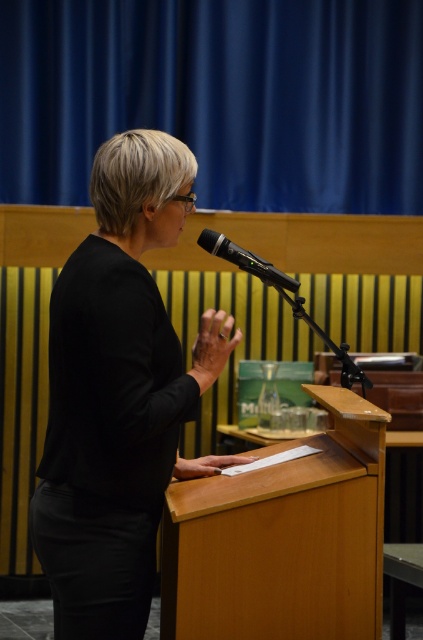
Question: Is black matte shirt at center closer to camera compared to light brown wood podium at center?

Choices:
 (A) yes
 (B) no

Answer: (A)

Question: Can you confirm if blue fabric curtain at upper center is wider than light brown wood podium at center?

Choices:
 (A) no
 (B) yes

Answer: (B)

Question: Can you confirm if light brown wood podium at center is positioned to the right of black metallic microphone at center?

Choices:
 (A) no
 (B) yes

Answer: (B)

Question: Which object is the closest to the light brown wood podium at center?

Choices:
 (A) blue fabric curtain at upper center
 (B) black matte shirt at center

Answer: (B)

Question: Which object is closer to the camera taking this photo?

Choices:
 (A) black matte shirt at center
 (B) black metallic microphone at center

Answer: (A)

Question: Which point is farther from the camera taking this photo?

Choices:
 (A) (296, 467)
 (B) (129, 419)
 (C) (282, 282)

Answer: (C)